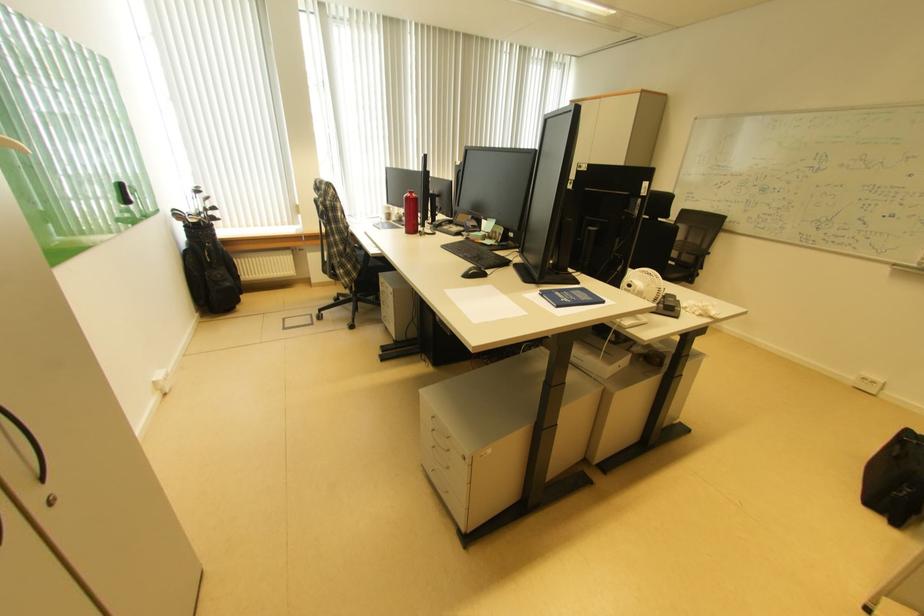
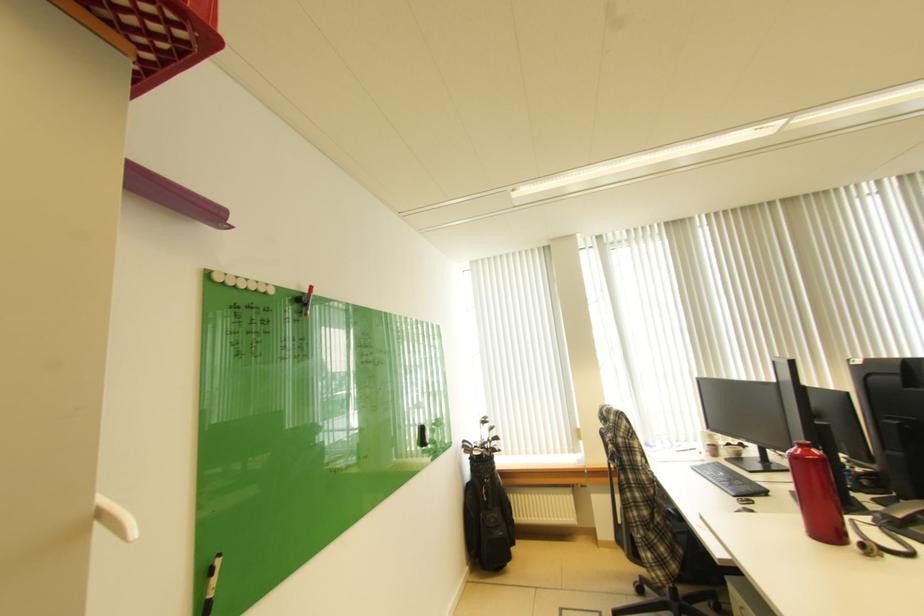
First-person continuous shooting, in which direction is the camera rotating?

The camera rotated toward left-up.